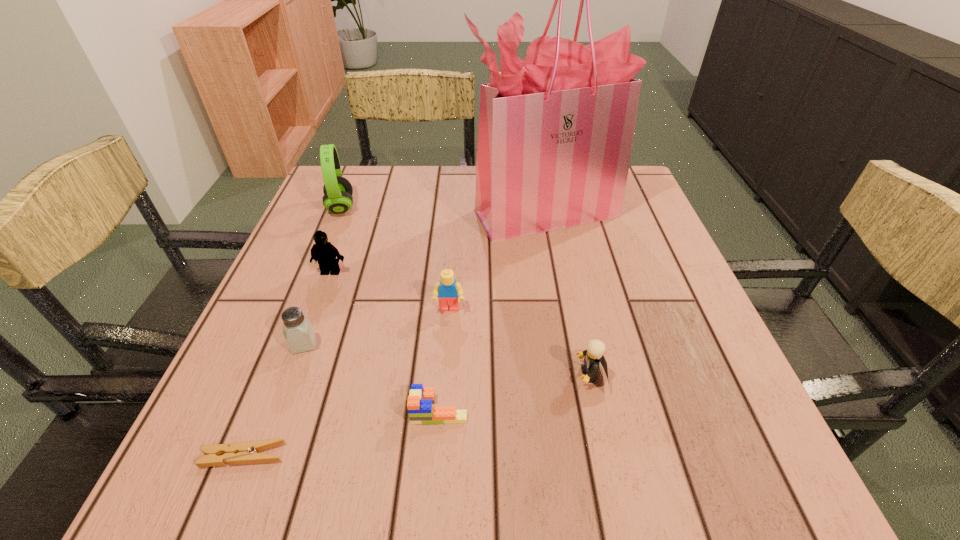
The image size is (960, 540). What are the coordinates of `vacant space in between the second farthest Lego and the leftmost Lego` in the screenshot? It's located at (390, 291).

Locate an element on the screen. This screenshot has height=540, width=960. vacant point located between the leftmost Lego and the rightmost Lego is located at coordinates (461, 323).

This screenshot has height=540, width=960. I want to click on free spot between the farthest Lego and the seventh shortest object, so click(336, 239).

The image size is (960, 540). I want to click on free area in between the fourth farthest object and the sixth nearest object, so click(x=390, y=291).

The image size is (960, 540). Find the location of `free spot between the third nearest Lego and the clothespin`. free spot between the third nearest Lego and the clothespin is located at coordinates (347, 382).

Select which object is the sixth closest to the headset. Please provide its 2D coordinates. Your answer should be formatted as a tuple, i.e. [(x, y)], where the tuple contains the x and y coordinates of a point satisfying the conditions above.

[(245, 452)]

Choose which object is the nearest neighbor to the nearest object. Please provide its 2D coordinates. Your answer should be formatted as a tuple, i.e. [(x, y)], where the tuple contains the x and y coordinates of a point satisfying the conditions above.

[(298, 331)]

This screenshot has width=960, height=540. I want to click on the fourth closest Lego relative to the saltshaker, so click(594, 356).

I want to click on Lego that stands as the third closest to the rightmost Lego, so click(x=324, y=252).

The height and width of the screenshot is (540, 960). Identify the location of free space that satisfies the following two spatial constraints: 1. on the front side of the saltshaker; 2. on the left side of the headset. (285, 344).